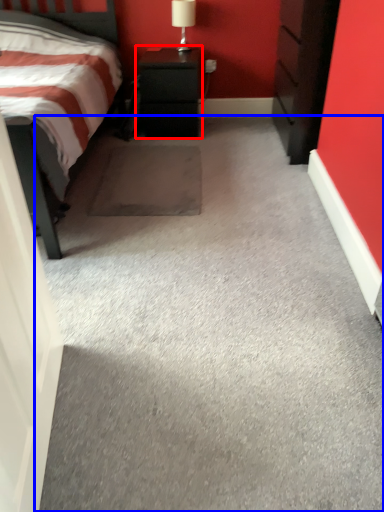
Question: Which object appears farthest to the camera in this image, nightstand (highlighted by a red box) or concrete (highlighted by a blue box)?

Choices:
 (A) nightstand
 (B) concrete

Answer: (A)